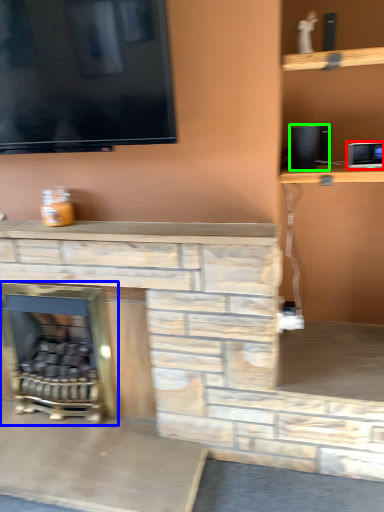
Question: Which object is the farthest from appliance (highlighted by a red box)? Choose among these: fireplace (highlighted by a blue box) or speaker (highlighted by a green box).

Choices:
 (A) fireplace
 (B) speaker

Answer: (A)